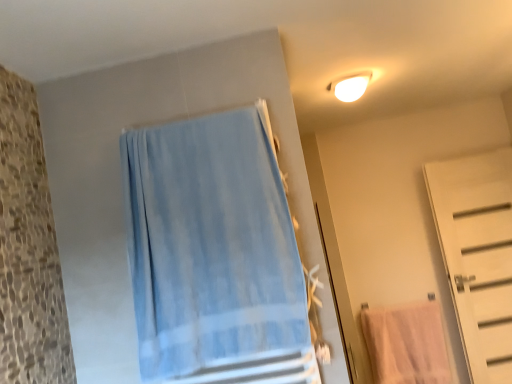
Question: Can you confirm if pink cotton towel at lower right is shorter than white glossy light fixture at upper right?

Choices:
 (A) no
 (B) yes

Answer: (A)

Question: From a real-world perspective, is pink cotton towel at lower right over white glossy light fixture at upper right?

Choices:
 (A) yes
 (B) no

Answer: (B)

Question: Are pink cotton towel at lower right and white glossy light fixture at upper right far apart?

Choices:
 (A) no
 (B) yes

Answer: (B)

Question: Does pink cotton towel at lower right have a lesser width compared to white glossy light fixture at upper right?

Choices:
 (A) no
 (B) yes

Answer: (B)

Question: Is white glossy light fixture at upper right at the back of pink cotton towel at lower right?

Choices:
 (A) no
 (B) yes

Answer: (A)

Question: Would you say white matte door at right is to the left or to the right of pink cotton towel at lower right in the picture?

Choices:
 (A) left
 (B) right

Answer: (B)

Question: In terms of size, does white matte door at right appear bigger or smaller than pink cotton towel at lower right?

Choices:
 (A) small
 (B) big

Answer: (B)

Question: Choose the correct answer: Is white matte door at right inside pink cotton towel at lower right or outside it?

Choices:
 (A) outside
 (B) inside

Answer: (A)

Question: In terms of width, does white matte door at right look wider or thinner when compared to pink cotton towel at lower right?

Choices:
 (A) wide
 (B) thin

Answer: (A)

Question: Is white matte door at right situated inside light blue fabric towel at center or outside?

Choices:
 (A) inside
 (B) outside

Answer: (B)

Question: Relative to light blue fabric towel at center, is white matte door at right in front or behind?

Choices:
 (A) behind
 (B) front

Answer: (A)

Question: Visually, is white matte door at right positioned to the left or to the right of light blue fabric towel at center?

Choices:
 (A) right
 (B) left

Answer: (A)

Question: From their relative heights in the image, would you say white matte door at right is taller or shorter than light blue fabric towel at center?

Choices:
 (A) tall
 (B) short

Answer: (A)

Question: Considering the positions of point (481, 167) and point (351, 74), is point (481, 167) closer or farther from the camera than point (351, 74)?

Choices:
 (A) closer
 (B) farther

Answer: (B)

Question: Is white matte door at right bigger or smaller than white glossy light fixture at upper right?

Choices:
 (A) big
 (B) small

Answer: (A)